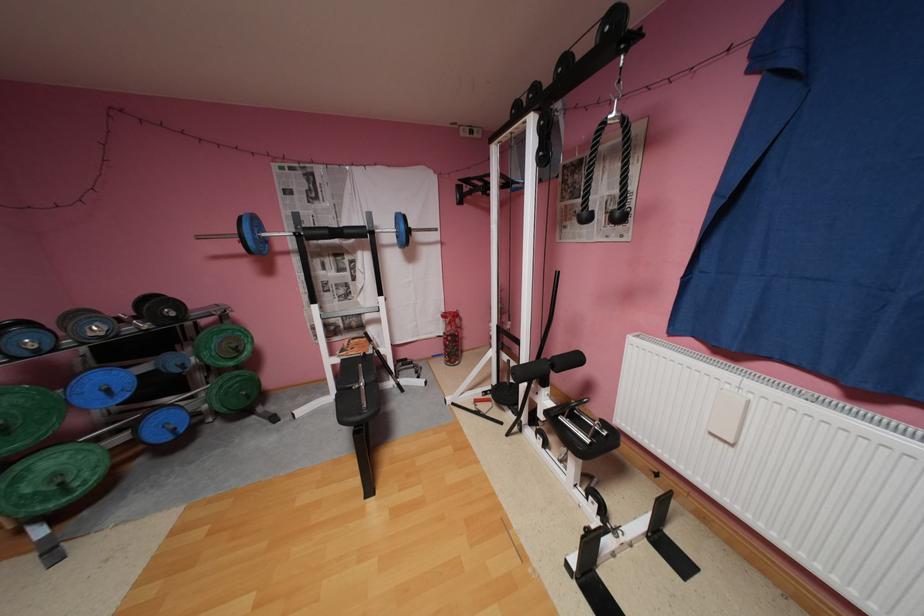
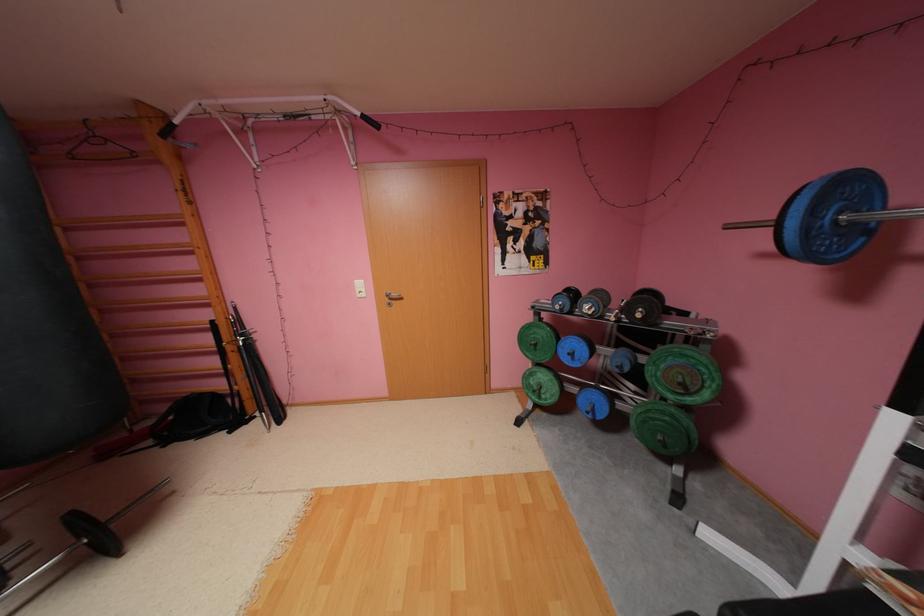
Locate, in the second image, the point that corresponds to (x=264, y=222) in the first image.

(855, 188)